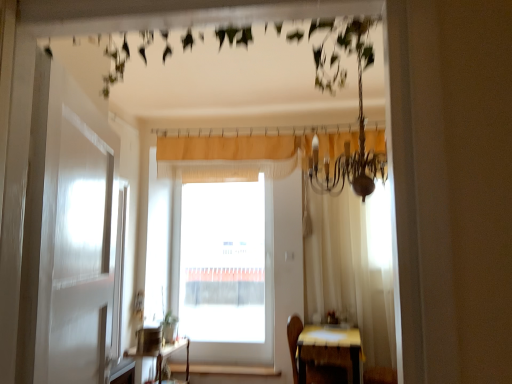
Question: From the image's perspective, is wooden table at center, placed as the first table when sorted from left to right, positioned above or below wooden table at lower right, which is the second table from left to right?

Choices:
 (A) above
 (B) below

Answer: (B)

Question: In terms of width, does wooden table at center, placed as the first table when sorted from left to right, look wider or thinner when compared to wooden table at lower right, positioned as the 1th table in right-to-left order?

Choices:
 (A) thin
 (B) wide

Answer: (A)

Question: Estimate the real-world distances between objects in this image. Which object is closer to the wooden table at center, which appears as the 2th table when viewed from the right?

Choices:
 (A) beige textured curtain at center
 (B) wooden table at lower right, positioned as the 1th table in right-to-left order
 (C) wooden at lower center
 (D) transparent glass window at center

Answer: (C)

Question: Estimate the real-world distances between objects in this image. Which object is closer to the wooden table at lower right, positioned as the 1th table in right-to-left order?

Choices:
 (A) beige textured curtain at center
 (B) wooden table at center, which appears as the 2th table when viewed from the right
 (C) transparent glass window at center
 (D) wooden at lower center

Answer: (D)